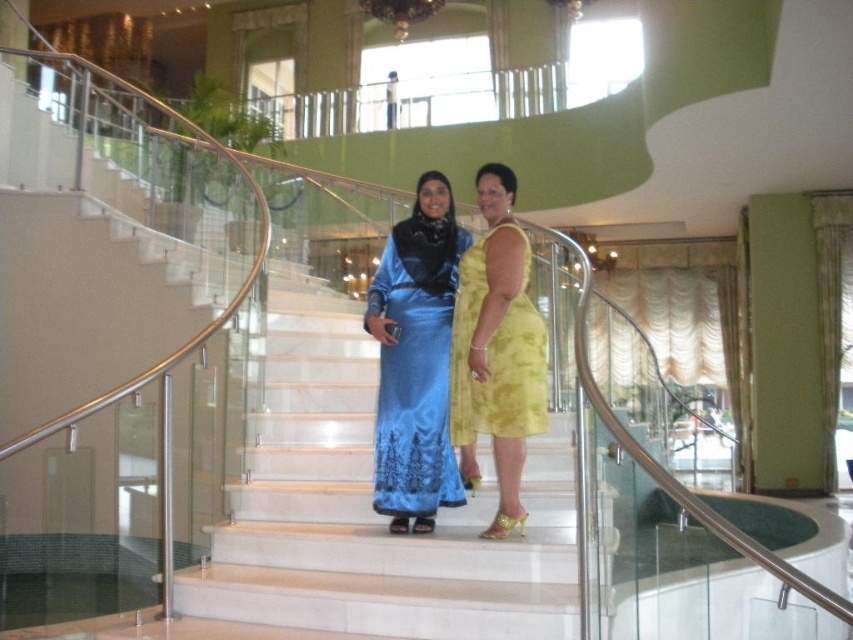
Question: Is white marble stairs at center bigger than yellow satin dress at center?

Choices:
 (A) no
 (B) yes

Answer: (B)

Question: Does white marble stairs at center have a lesser width compared to yellow satin dress at center?

Choices:
 (A) no
 (B) yes

Answer: (A)

Question: Is satin blue dress at center bigger than yellow satin dress at center?

Choices:
 (A) no
 (B) yes

Answer: (B)

Question: Which point is closer to the camera?

Choices:
 (A) yellow satin dress at center
 (B) white marble stairs at center

Answer: (B)

Question: Which of these objects is positioned closest to the yellow satin dress at center?

Choices:
 (A) satin blue dress at center
 (B) white marble stairs at center

Answer: (A)

Question: Which object is closer to the camera taking this photo?

Choices:
 (A) satin blue dress at center
 (B) yellow satin dress at center

Answer: (B)